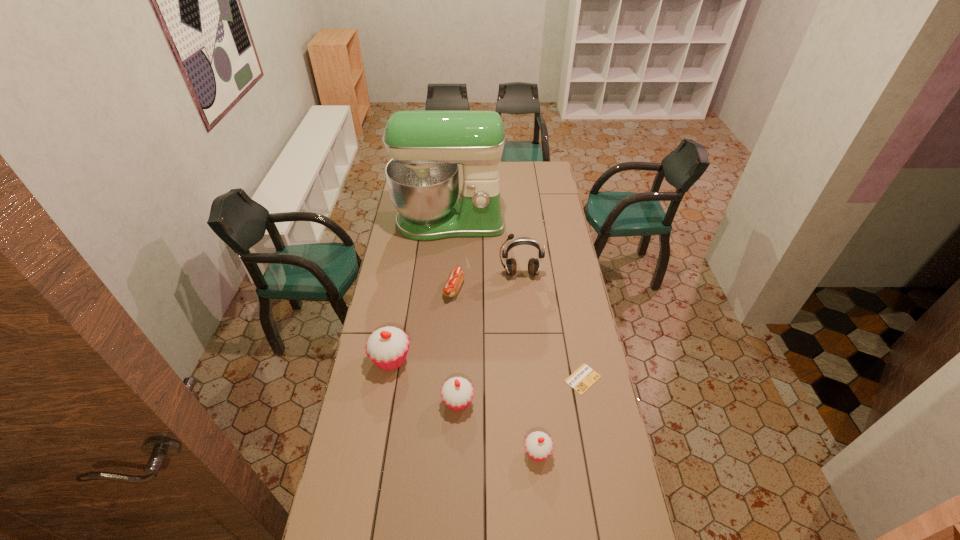
Locate an element on the screen. This screenshot has width=960, height=540. the rightmost object is located at coordinates (584, 377).

Where is `identity card`? identity card is located at coordinates (584, 377).

The image size is (960, 540). In order to click on vacant space located 0.310m on the back of the leftmost cupcake in this screenshot , I will do pyautogui.click(x=403, y=288).

The height and width of the screenshot is (540, 960). Find the location of `free point located on the front of the second farthest cupcake`. free point located on the front of the second farthest cupcake is located at coordinates (454, 497).

In order to click on vacant space situated 0.100m on the back of the nearest cupcake in this screenshot , I will do `click(534, 411)`.

Locate an element on the screen. This screenshot has width=960, height=540. vacant point located on the controls of the tallest object is located at coordinates [446, 262].

Locate an element on the screen. The image size is (960, 540). free space located 0.280m on the right of the second shortest object is located at coordinates (525, 289).

At what (x,y) coordinates should I click in order to perform the action: click on vacant space situated on the ear pads of the earphone. Please return your answer as a coordinate pair (x, y). Looking at the image, I should click on [x=524, y=315].

The width and height of the screenshot is (960, 540). In order to click on vacant space located on the back of the identity card in this screenshot , I will do `click(572, 323)`.

This screenshot has height=540, width=960. Identify the location of cupcake present at the left edge. (387, 347).